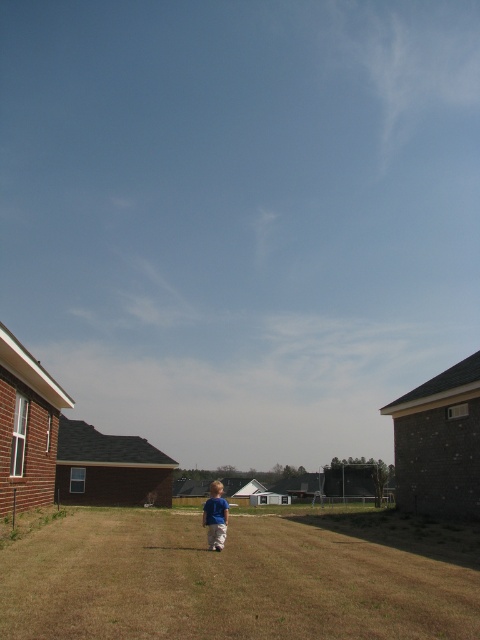
Question: Does brown dry grass at center have a smaller size compared to blue cotton shirt at center?

Choices:
 (A) yes
 (B) no

Answer: (B)

Question: Is brown dry grass at center to the right of blue cotton shirt at center from the viewer's perspective?

Choices:
 (A) no
 (B) yes

Answer: (A)

Question: Does brown dry grass at center have a larger size compared to blue cotton shirt at center?

Choices:
 (A) no
 (B) yes

Answer: (B)

Question: Which point appears farthest from the camera in this image?

Choices:
 (A) pos(115,627)
 (B) pos(211,515)

Answer: (B)